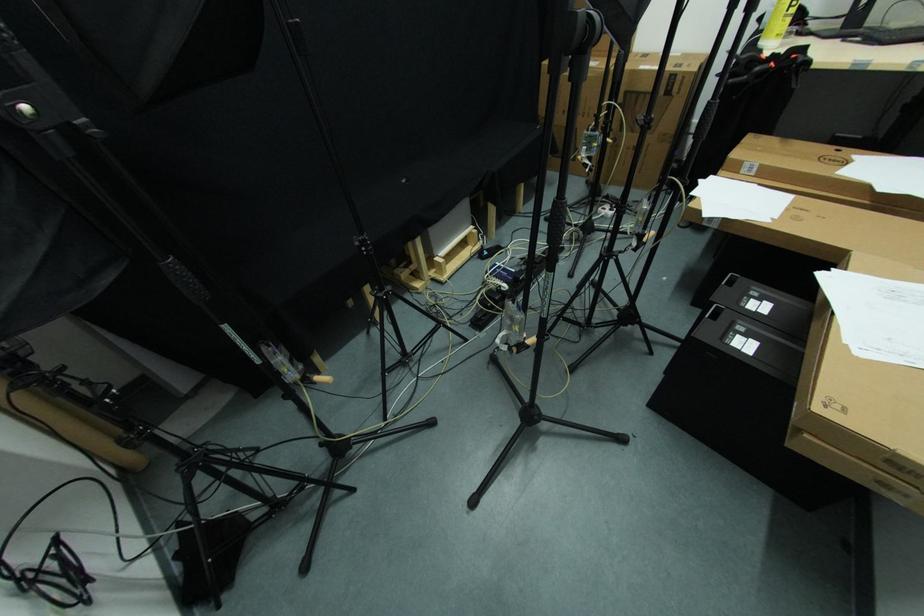
Find the location of a particular element. The height and width of the screenshot is (616, 924). textured stand grip is located at coordinates (544, 296).